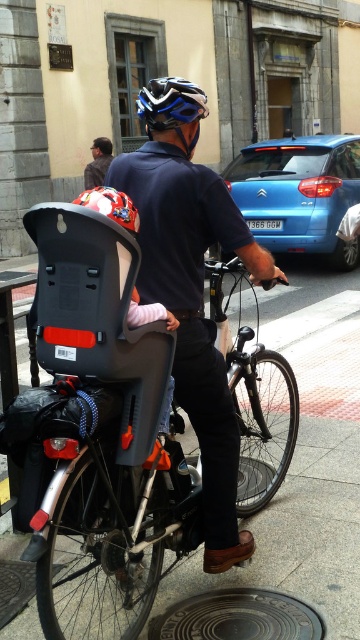
Question: Which point is farther to the camera?

Choices:
 (A) (259, 488)
 (B) (86, 244)

Answer: (A)

Question: Estimate the real-world distances between objects in this image. Which object is closer to the matte red helmet at upper left?

Choices:
 (A) matte red helmet at center
 (B) blue metallic car at center
 (C) dark blue shirt at center
 (D) matte black bicycle seat at center

Answer: (A)

Question: Among these objects, which one is nearest to the camera?

Choices:
 (A) blue matte bicycle helmet at upper center
 (B) matte black bicycle seat at center
 (C) matte red helmet at center

Answer: (C)

Question: Does matte black bicycle seat at center appear over blue matte bicycle helmet at upper center?

Choices:
 (A) no
 (B) yes

Answer: (A)

Question: Can you confirm if matte black bicycle seat at center is positioned to the left of matte gray plastic baby carriage at center?

Choices:
 (A) yes
 (B) no

Answer: (B)

Question: Is matte gray plastic baby carriage at center thinner than dark blue shirt at center?

Choices:
 (A) yes
 (B) no

Answer: (A)